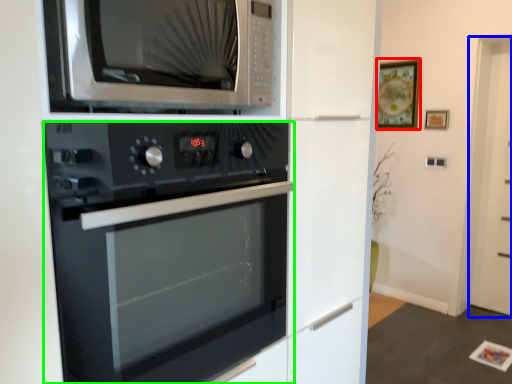
Question: Estimate the real-world distances between objects in this image. Which object is farther from picture frame (highlighted by a red box), glass door (highlighted by a blue box) or oven (highlighted by a green box)?

Choices:
 (A) glass door
 (B) oven

Answer: (B)